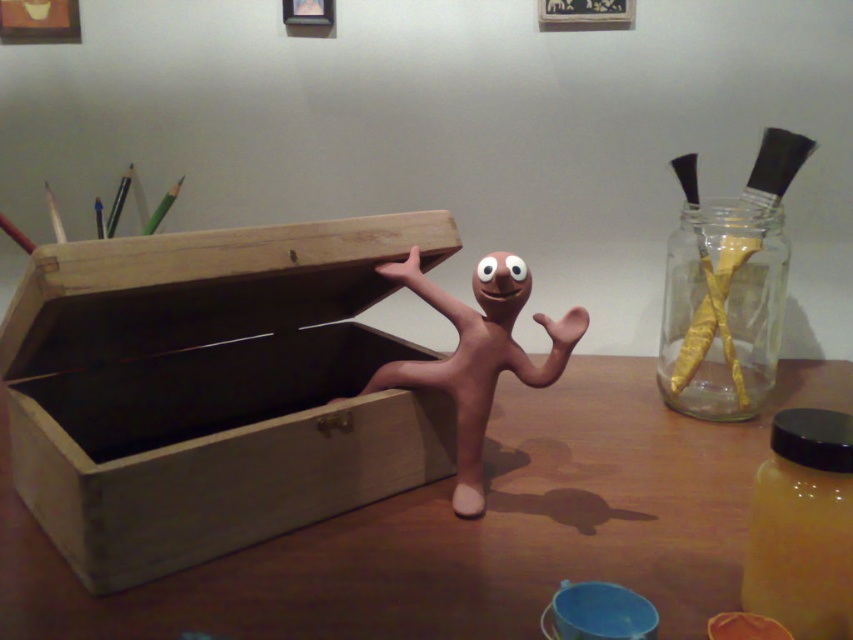
You are an artist standing in front of the brown wooden table at center and the matte clay figure at center. You want to place a new sculpture on the table. Which object should you use as a reference point to ensure the sculpture is placed closer to you?

You should use the brown wooden table at center as the reference point because it is closer to you than the matte clay figure at center. Placing the sculpture near the table ensures it is closer to your current position.

Based on the photo, you are organizing a craft fair and need to place both the brown wooden table at center and the gold foil wrapped at right on a display shelf. The shelf has limited space, and you want to ensure that the larger item is placed first to maximize stability. Which object should you place first?

The brown wooden table at center is larger in size than the gold foil wrapped at right, so you should place the brown wooden table at center first to ensure stability.